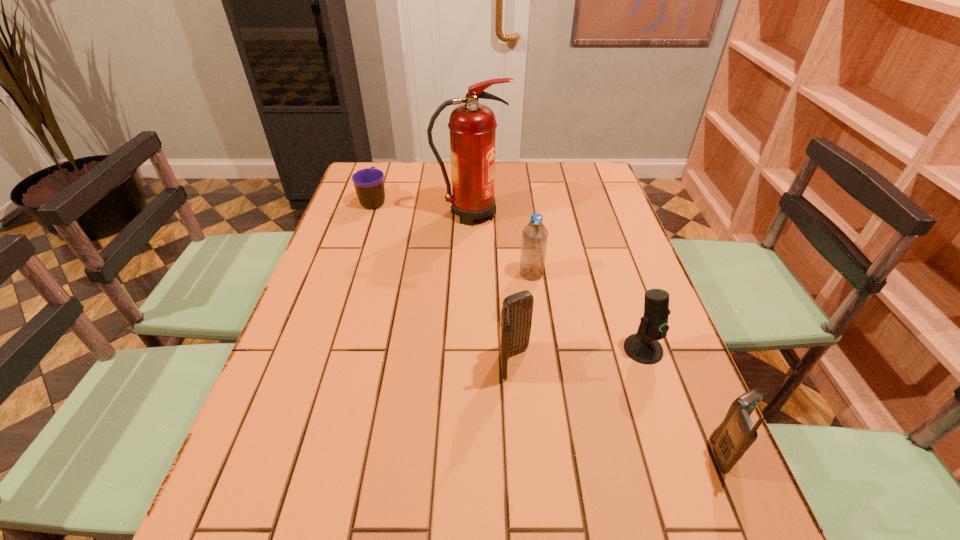
In order to click on free region located 0.200m on the left of the fourth nearest object in this screenshot , I will do coord(445,273).

Locate an element on the screen. This screenshot has height=540, width=960. free location located with the handle on the side of the mug is located at coordinates (385, 168).

Where is `free point located with the handle on the side of the mug`? free point located with the handle on the side of the mug is located at coordinates (380, 182).

Locate an element on the screen. This screenshot has width=960, height=540. free space located 0.160m with the handle on the side of the mug is located at coordinates (385, 167).

At what (x,y) coordinates should I click in order to perform the action: click on vacant space located 0.070m on the front-facing side of the fire extinguisher. Please return your answer as a coordinate pair (x, y). The height and width of the screenshot is (540, 960). Looking at the image, I should click on (529, 213).

Locate an element on the screen. This screenshot has height=540, width=960. vacant space situated 0.240m on the left of the microphone is located at coordinates (519, 349).

The width and height of the screenshot is (960, 540). Identify the location of object that is at the far edge. (369, 183).

Locate an element on the screen. The width and height of the screenshot is (960, 540). object situated at the near edge is located at coordinates click(732, 438).

The image size is (960, 540). I want to click on object located in the left edge section of the desktop, so click(369, 183).

You are a GUI agent. You are given a task and a screenshot of the screen. Output one action in this format:
    pyautogui.click(x=<x>, y=<y>)
    Task: Click on the cellular telephone situated at the right edge
    The image size is (960, 540).
    Given the screenshot: What is the action you would take?
    pyautogui.click(x=732, y=438)